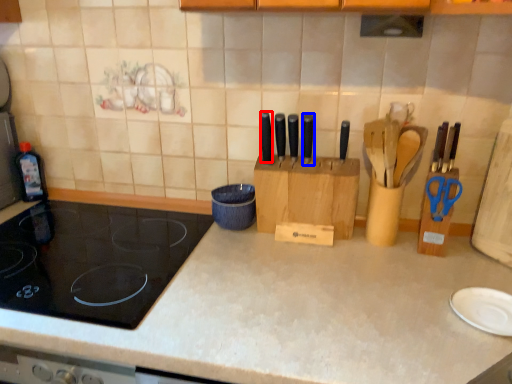
Question: Which point is further to the camera, knife (highlighted by a red box) or knife (highlighted by a blue box)?

Choices:
 (A) knife
 (B) knife

Answer: (A)